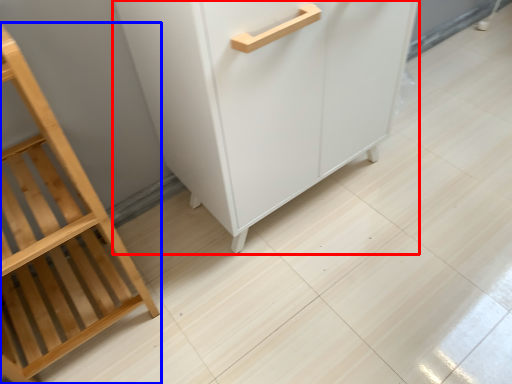
Question: Which of the following is the closest to the observer, cupboard (highlighted by a red box) or furniture (highlighted by a blue box)?

Choices:
 (A) cupboard
 (B) furniture

Answer: (B)